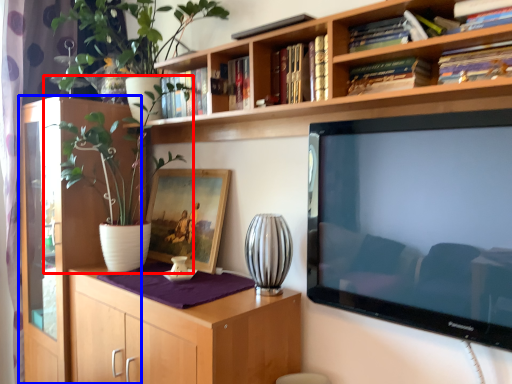
Question: Which object is closer to the camera taking this photo, houseplant (highlighted by a red box) or cabinetry (highlighted by a blue box)?

Choices:
 (A) houseplant
 (B) cabinetry

Answer: (A)